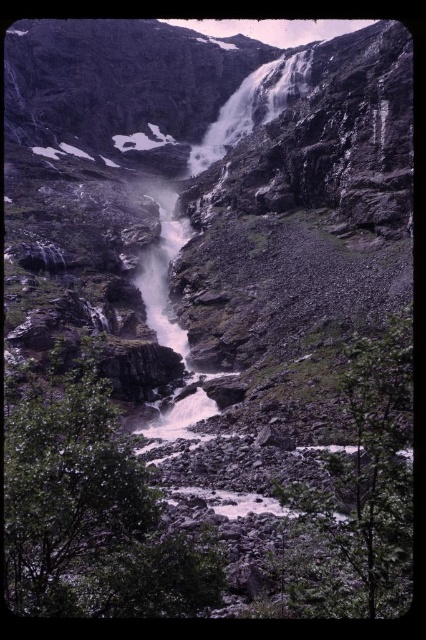
You are standing at the base of the waterfall and see the green leafy tree at center and the green leafy tree at lower right. Which tree is positioned to the left when facing the waterfall?

The green leafy tree at center is positioned to the left of the green leafy tree at lower right.

You are a hiker who wants to take a photo of the waterfall. You notice two green leafy trees in the scene. Which tree, the green leafy tree at center or the green leafy tree at lower right, is closer to you?

The green leafy tree at center is closer to you because the green leafy tree at lower right is behind it.

You are standing at the base of the waterfall and notice two points marked in the scene. The first point is at coordinate point (x=34, y=458) and the second point is at coordinate point (x=403, y=392). Which point is closer to you?

Point (x=403, y=392) is closer to you because it is in front of point (x=34, y=458).